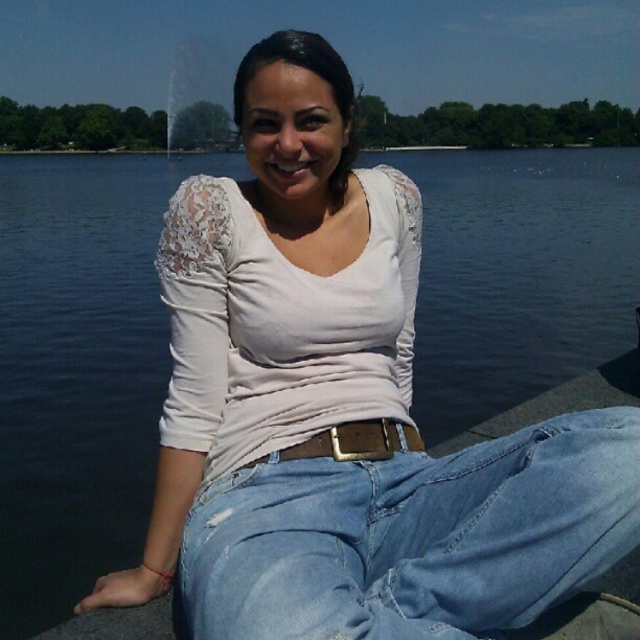
You are a fashion designer analyzing the outfit of the person in the image. Which item of clothing is positioned closer to the viewer between the denim jeans at lower center and the brown leather belt at center?

The denim jeans at lower center are positioned closer to the viewer than the brown leather belt at center, as they are in front of it according to the description.

You are a fashion designer analyzing the outfit of the person in the image. Which item of clothing has a greater width between the denim jeans at lower center and the brown leather belt at center?

The denim jeans at lower center has a greater width than the brown leather belt at center.

You are a fashion designer observing the scene. You need to determine which item of clothing is larger between the denim jeans at lower center and the brown leather belt at center. Which one is bigger?

The denim jeans at lower center is bigger than the brown leather belt at center, so the denim jeans at lower center is larger.